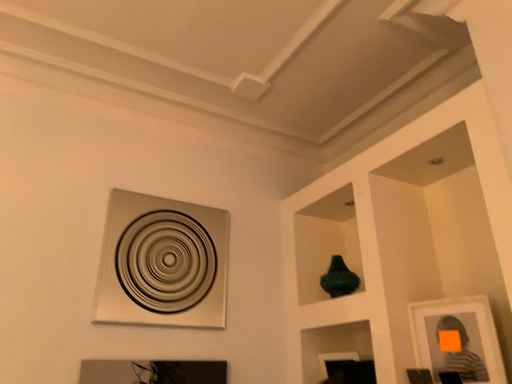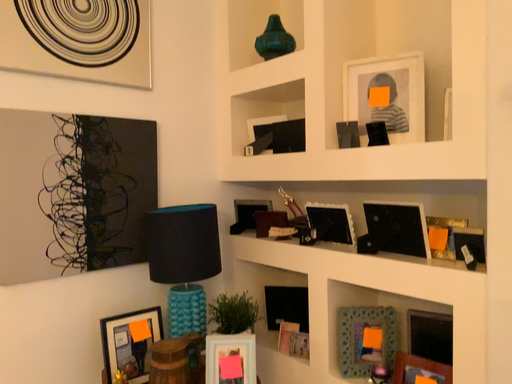
Question: Which way did the camera rotate in the video?

Choices:
 (A) rotated upward
 (B) rotated downward

Answer: (B)